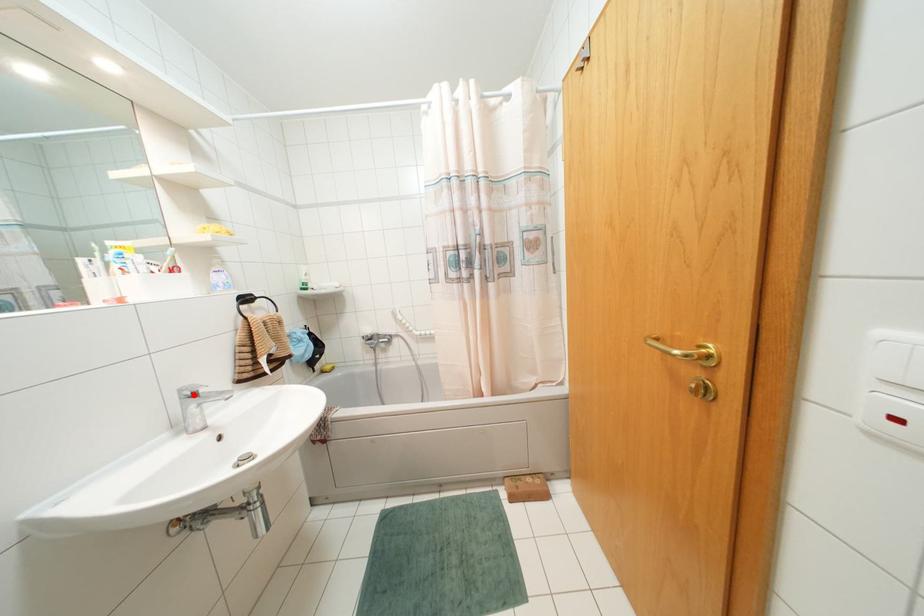
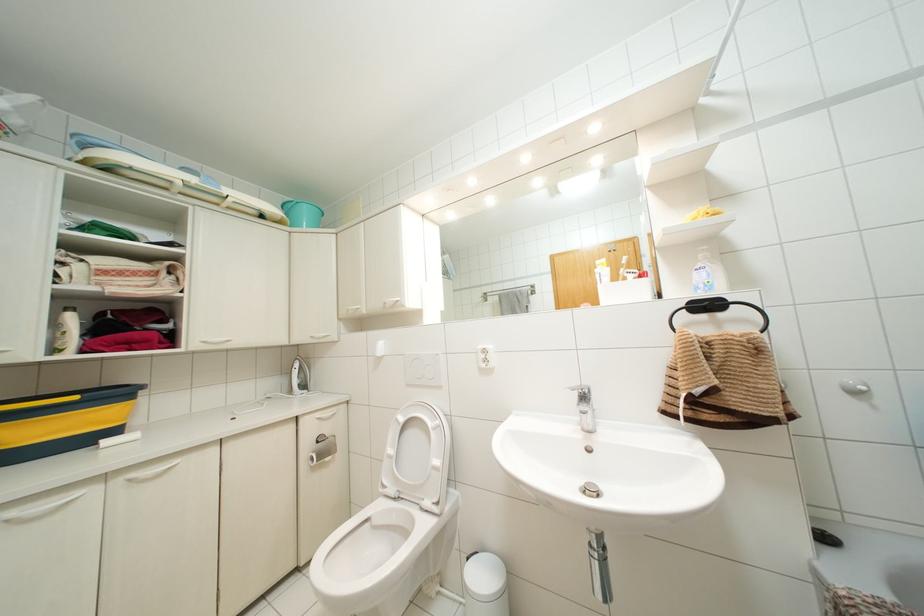
Where in the second image is the point corresponding to the highlighted location from the first image?

(584, 395)